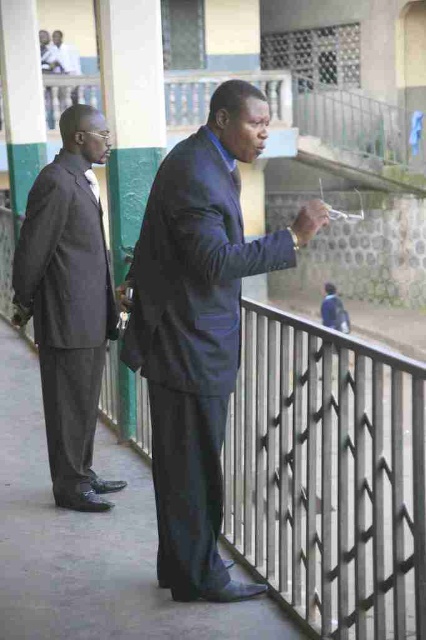
Question: Which point appears farthest from the camera in this image?

Choices:
 (A) (20, 467)
 (B) (63, 410)
 (C) (242, 122)

Answer: (A)

Question: Is gray concrete pavement at center positioned behind matte gray suit at left?

Choices:
 (A) yes
 (B) no

Answer: (B)

Question: Can you confirm if matte black suit at center is wider than gray concrete pavement at center?

Choices:
 (A) no
 (B) yes

Answer: (A)

Question: Which of the following is the closest to the observer?

Choices:
 (A) (195, 618)
 (B) (97, 392)

Answer: (A)

Question: Which object appears farthest from the camera in this image?

Choices:
 (A) gray concrete pavement at center
 (B) matte gray suit at left
 (C) matte black suit at center

Answer: (B)

Question: Is matte black suit at center below matte gray suit at left?

Choices:
 (A) no
 (B) yes

Answer: (B)